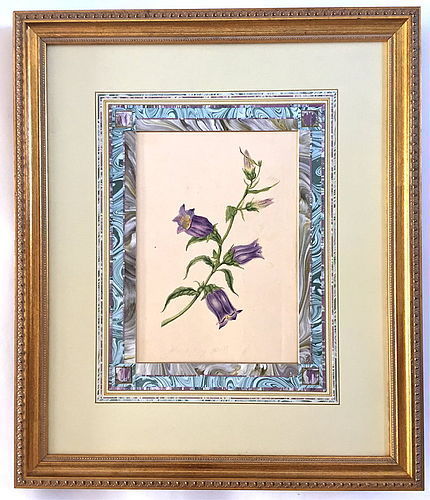
Locate an element on the screen. decorative swirl design in blue and fray coloring is located at coordinates (116, 265), (130, 267), (305, 260), (313, 260), (221, 121), (218, 112), (209, 383), (209, 368).